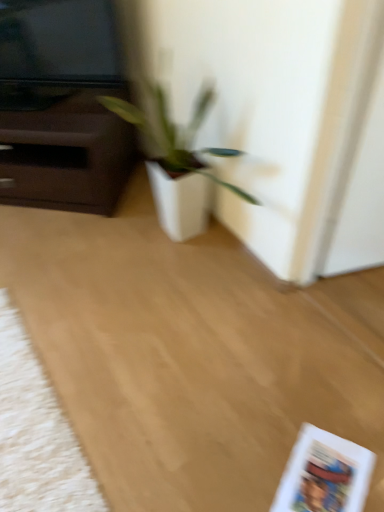
Identify the location of vacant area that is situated to the right of white fluffy mat at lower left. (155, 400).